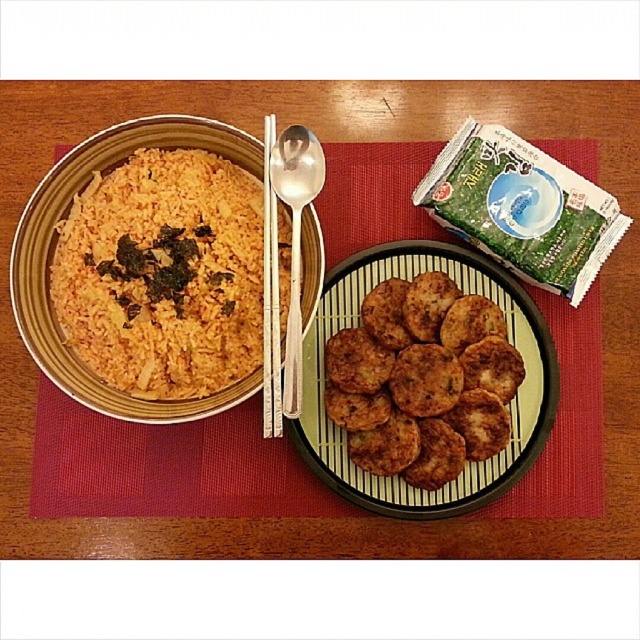
Is yellow matte rice at left shorter than white wood chopsticks at upper center?

Yes.

Between yellow matte rice at left and white wood chopsticks at upper center, which one is positioned higher?

white wood chopsticks at upper center is above.

Image resolution: width=640 pixels, height=640 pixels. Identify the location of yellow matte rice at left. (163, 275).

This screenshot has height=640, width=640. What are the coordinates of `yellow matte rice at left` in the screenshot? It's located at (163, 275).

Is point (502, 140) positioned after point (280, 333)?

Yes, it is.

Is green matte seaweed packet at upper right positioned behind white wood chopsticks at upper center?

Yes, it is.

The width and height of the screenshot is (640, 640). What are the coordinates of `green matte seaweed packet at upper right` in the screenshot? It's located at (522, 209).

Describe the element at coordinates (422, 380) in the screenshot. The image size is (640, 640). I see `brown crispy patties at center` at that location.

Between brown crispy patties at center and white wood chopsticks at upper center, which one appears on the right side from the viewer's perspective?

brown crispy patties at center

Does point (330, 365) lie in front of point (268, 385)?

No, it is behind (268, 385).

Locate an element on the screen. Image resolution: width=640 pixels, height=640 pixels. brown crispy patties at center is located at coordinates (422, 380).